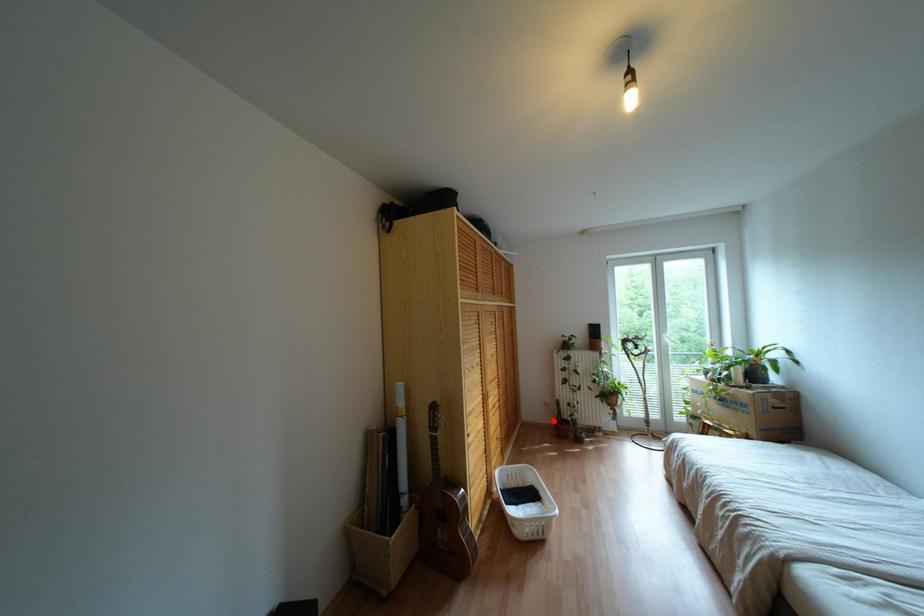
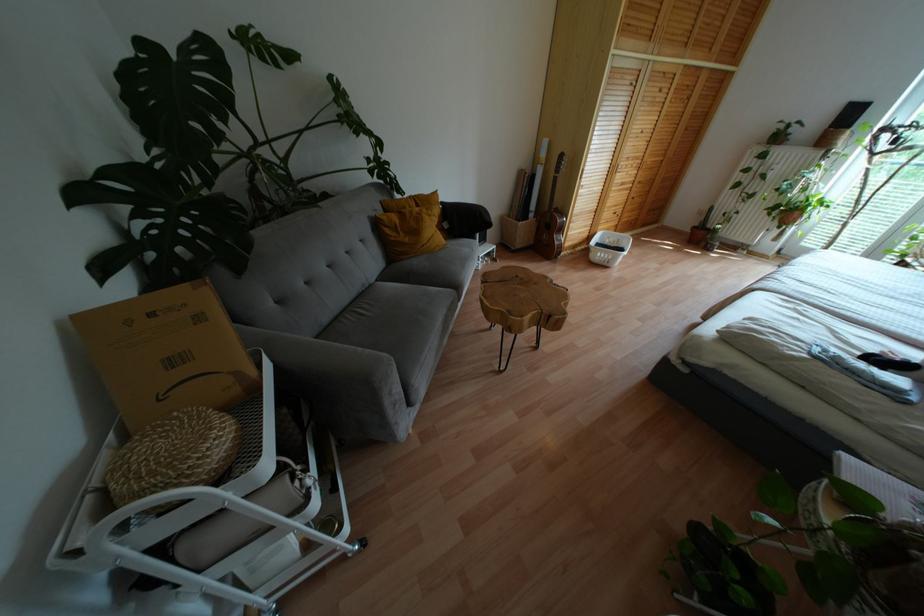
In the second image, find the point that corresponds to the highlighted location in the first image.

(694, 227)